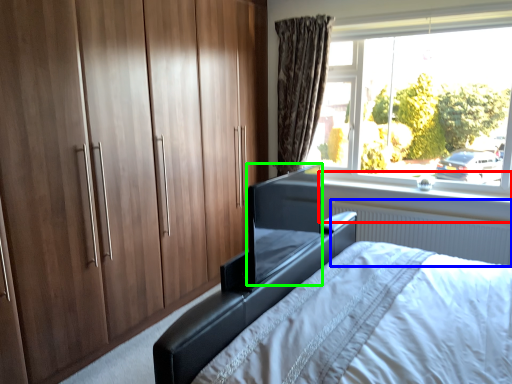
Question: Based on their relative distances, which object is farther from window sill (highlighted by a red box)? Choose from radiator (highlighted by a blue box) and window screen (highlighted by a green box).

Choices:
 (A) radiator
 (B) window screen

Answer: (B)